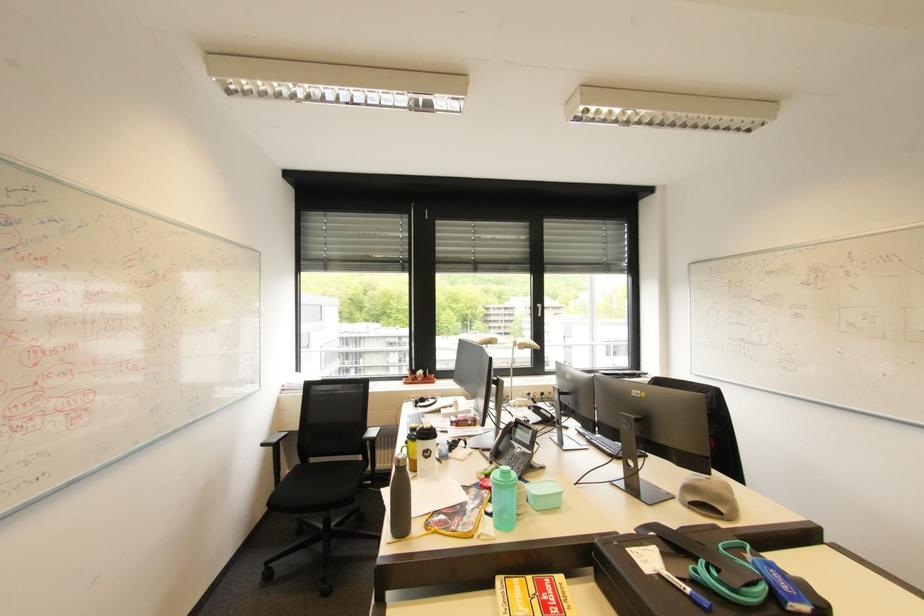
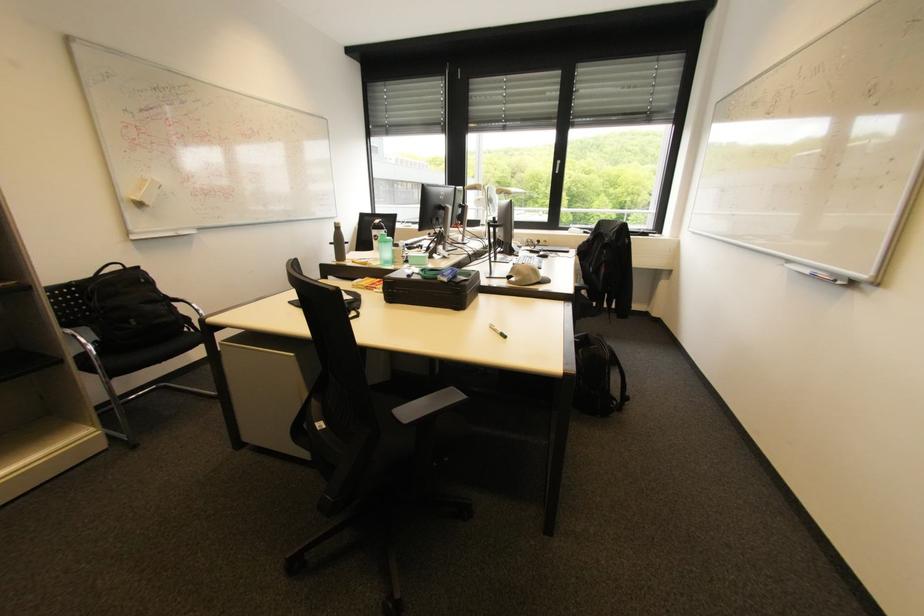
Where in the second image is the point corresponding to the point at 434,458 from the first image?

(382, 240)